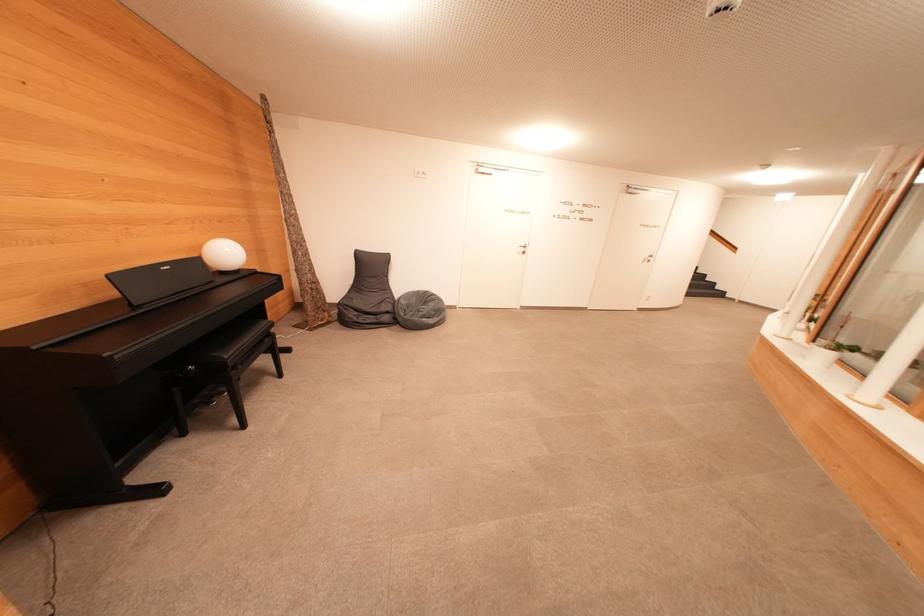
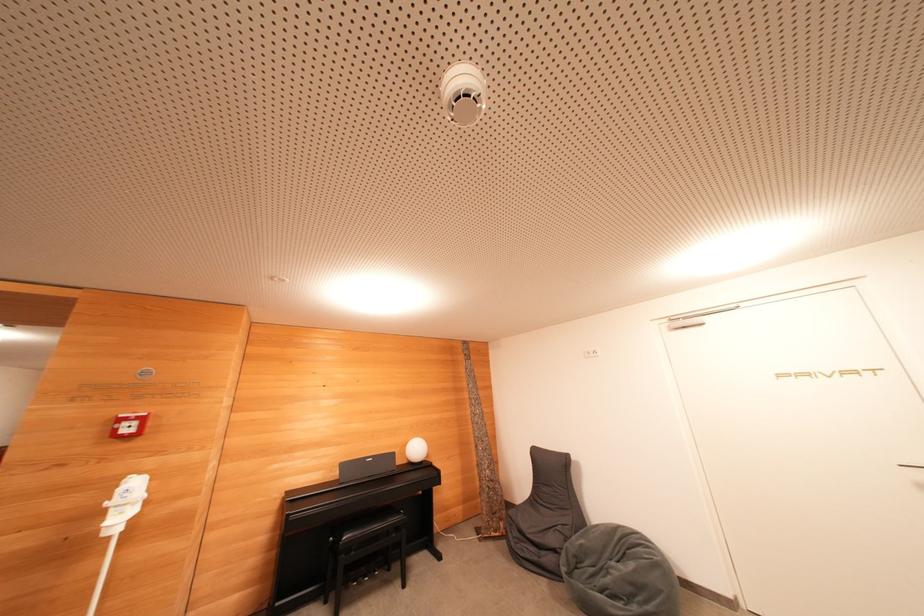
Locate, in the second image, the point that corresponds to the point at 232,257 in the first image.

(419, 453)